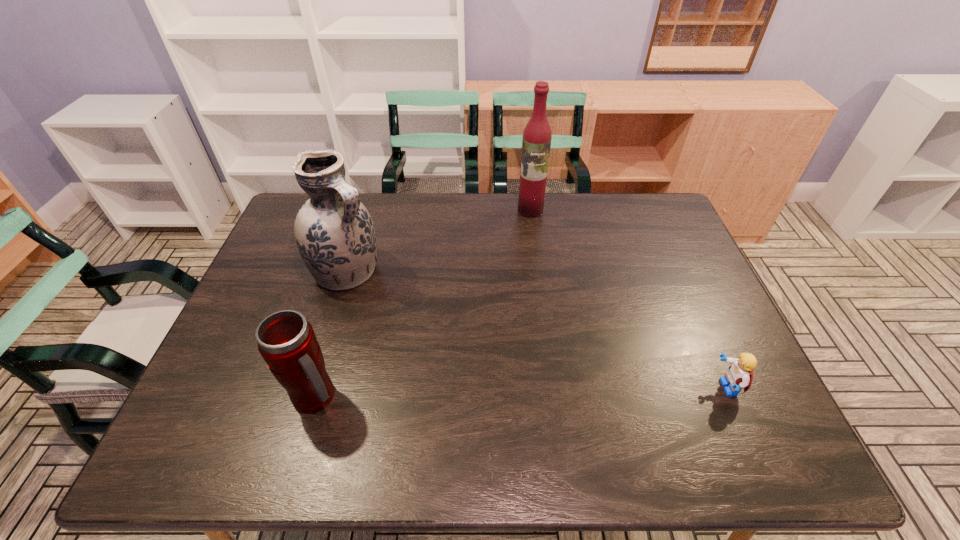
Find the location of a particular element. This screenshot has width=960, height=540. vacant point located between the shortest object and the thermos bottle is located at coordinates (521, 393).

Locate an element on the screen. The height and width of the screenshot is (540, 960). free point between the rightmost object and the third object from left to right is located at coordinates tap(628, 299).

What are the coordinates of `free area in between the vase and the thermos bottle` in the screenshot? It's located at (331, 334).

Locate an element on the screen. unoccupied position between the second object from right to left and the shortest object is located at coordinates pos(628,299).

Locate an element on the screen. The image size is (960, 540). vacant region between the rightmost object and the liquor is located at coordinates (628, 299).

At what (x,y) coordinates should I click in order to perform the action: click on vacant area that lies between the third tallest object and the farthest object. Please return your answer as a coordinate pair (x, y). This screenshot has height=540, width=960. Looking at the image, I should click on (423, 303).

The height and width of the screenshot is (540, 960). I want to click on free space between the rightmost object and the thermos bottle, so click(x=521, y=393).

Find the location of a particular element. The image size is (960, 540). free space that is in between the second tallest object and the Lego is located at coordinates (537, 329).

At what (x,y) coordinates should I click in order to perform the action: click on object that can be found as the third closest to the farthest object. Please return your answer as a coordinate pair (x, y). The width and height of the screenshot is (960, 540). Looking at the image, I should click on (286, 341).

Find the location of a particular element. The image size is (960, 540). object that can be found as the closest to the rightmost object is located at coordinates (536, 143).